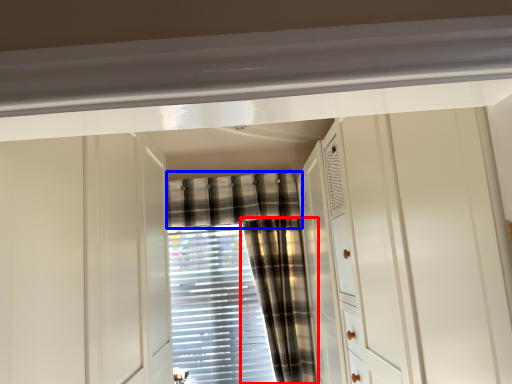
Question: Which point is closer to the camera, curtain (highlighted by a red box) or curtain (highlighted by a blue box)?

Choices:
 (A) curtain
 (B) curtain

Answer: (A)